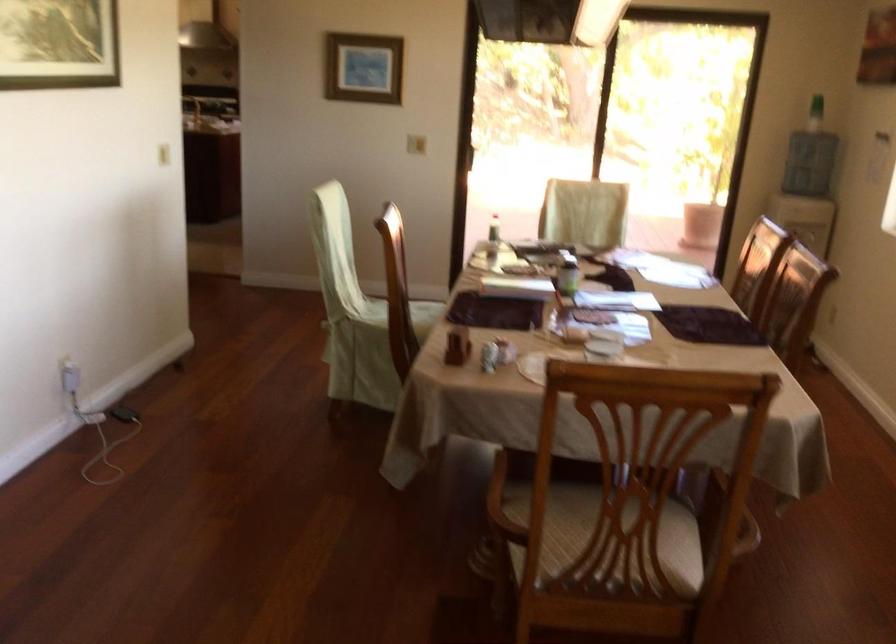
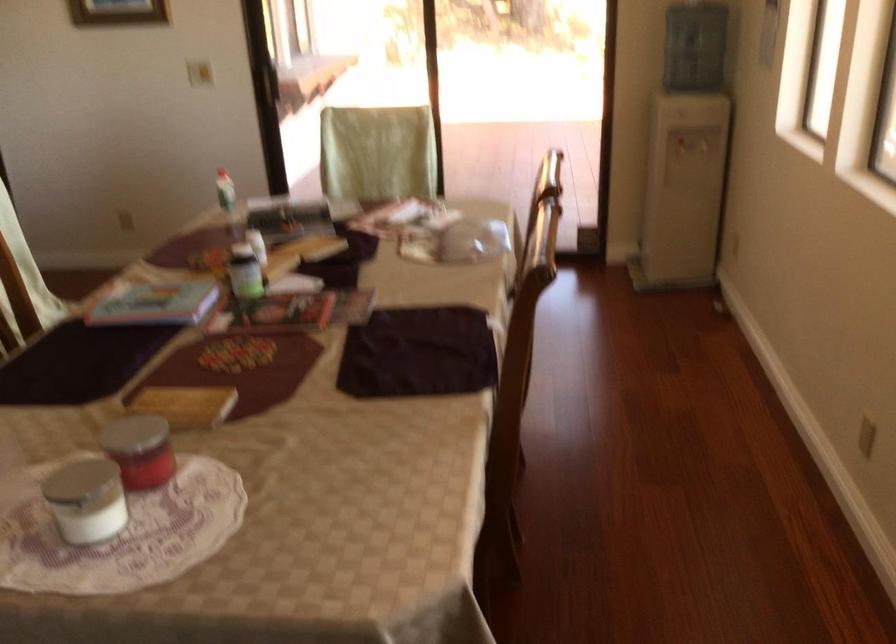
The point at (574, 270) is marked in the first image. Where is the corresponding point in the second image?

(245, 272)